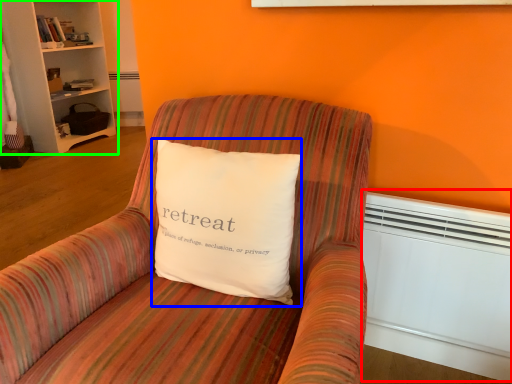
Question: Which object is the farthest from heater (highlighted by a red box)? Choose among these: pillow (highlighted by a blue box) or bookcase (highlighted by a green box).

Choices:
 (A) pillow
 (B) bookcase

Answer: (B)